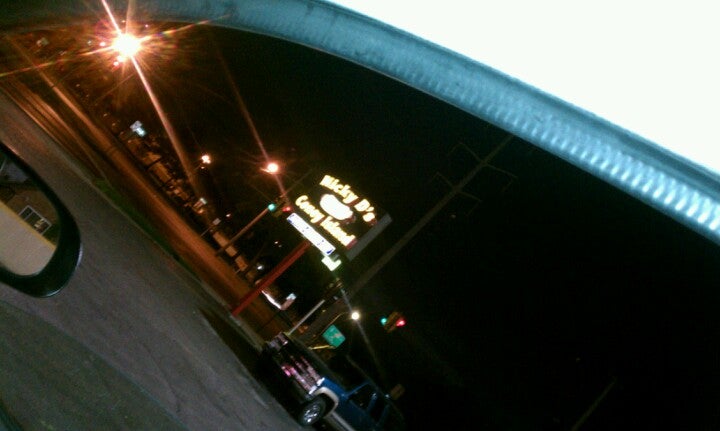
This screenshot has height=431, width=720. What are the coordinates of `mirror` in the screenshot? It's located at (21, 228).